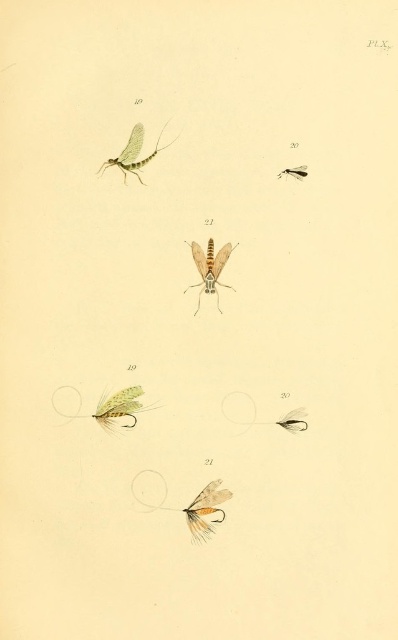
Who is lower down, translucent white feather at bottom center or translucent yellowish-brown mosquito at center?

translucent white feather at bottom center is lower down.

What are the coordinates of `translucent white feather at bottom center` in the screenshot? It's located at point(191,506).

Is point (224, 513) closer to camera compared to point (212, 248)?

Yes, point (224, 513) is in front of point (212, 248).

This screenshot has height=640, width=398. What are the coordinates of `translucent white feather at bottom center` in the screenshot? It's located at 191,506.

Between point (105, 419) and point (286, 168), which one is positioned in front?

Positioned in front is point (286, 168).

Is point (134, 410) positioned behind point (286, 170)?

Yes, it is.

You are a GUI agent. You are given a task and a screenshot of the screen. Output one action in this format:
    pyautogui.click(x=<x>, y=<y>)
    Task: Click on the translucent yellow fly at center
    
    Given the screenshot: What is the action you would take?
    pyautogui.click(x=107, y=406)

Between translucent yellow fly at center and translucent yellowish-brown mosquito at center, which one has more height?

With more height is translucent yellowish-brown mosquito at center.

Measure the distance between point (x=109, y=408) and camera.

A distance of 4.42 feet exists between point (x=109, y=408) and camera.

Which is behind, point (130, 390) or point (218, 284)?

The point (218, 284) is behind.

Find the location of a particular element. Image resolution: width=398 pixels, height=640 pixels. translucent yellow fly at center is located at coordinates (107, 406).